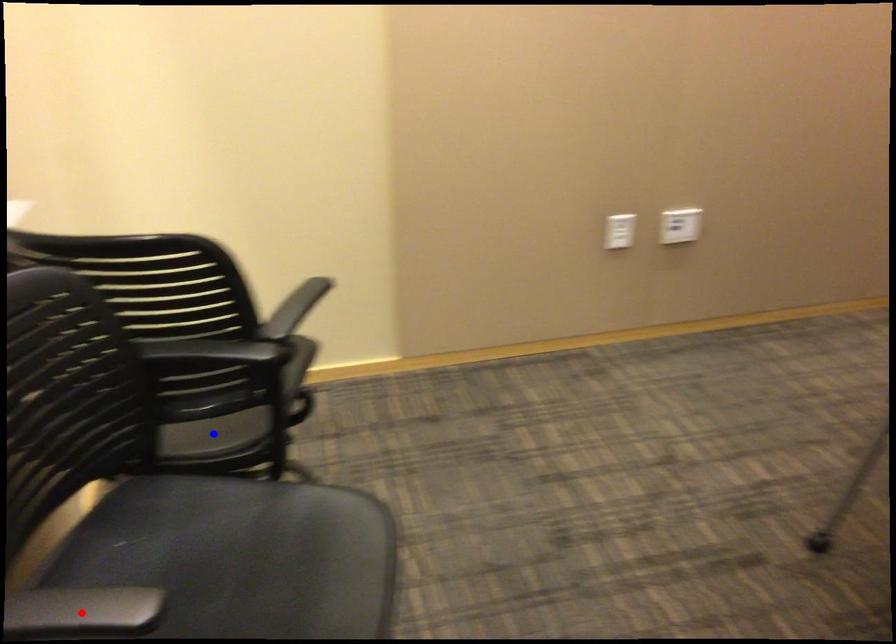
Question: In the image, two points are highlighted. Which point is nearer to the camera? Reply with the corresponding letter.

Choices:
 (A) blue point
 (B) red point

Answer: (B)